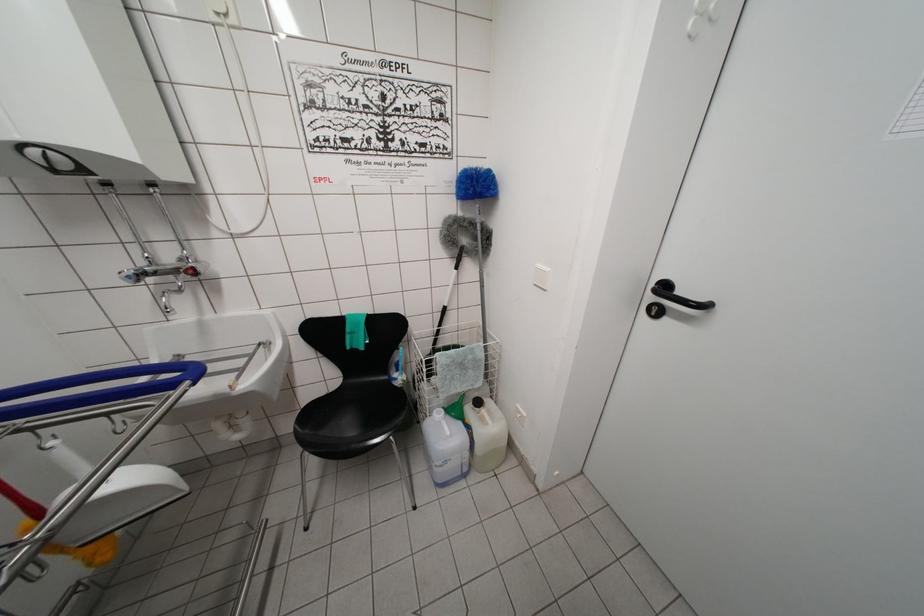
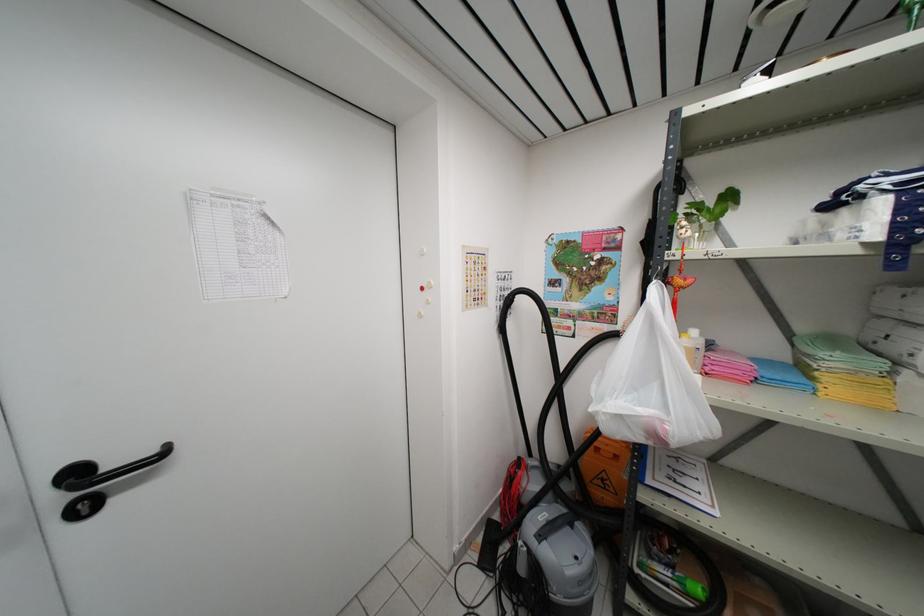
Where in the second image is the point corresponding to pixel 657 313 from the first image?

(83, 512)